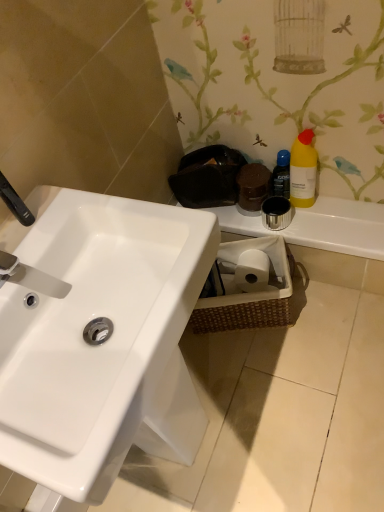
What are the coordinates of `free location to the right of brushed metal tap at upper left, the first plumbing fixture in the top-to-bottom sequence` in the screenshot? It's located at (89, 206).